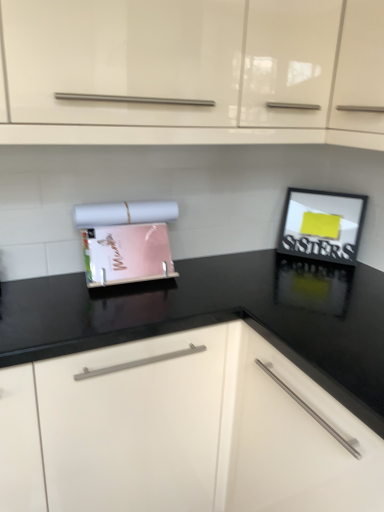
Question: From a real-world perspective, is black matte picture frame at upper right positioned above or below black glossy countertop at center, the first cabinetry in the bottom-to-top sequence?

Choices:
 (A) above
 (B) below

Answer: (A)

Question: In terms of height, does black matte picture frame at upper right look taller or shorter compared to black glossy countertop at center, placed as the 2th cabinetry when sorted from top to bottom?

Choices:
 (A) tall
 (B) short

Answer: (B)

Question: Which object is positioned farthest from the black glossy countertop at center, the first cabinetry in the bottom-to-top sequence?

Choices:
 (A) black matte picture frame at upper right
 (B) glossy white cabinet at upper center, the second cabinetry in the bottom-to-top sequence
 (C) matte plastic magazine holder at center

Answer: (A)

Question: Based on their relative distances, which object is farther from the matte plastic magazine holder at center?

Choices:
 (A) black matte picture frame at upper right
 (B) glossy white cabinet at upper center, which appears as the 1th cabinetry when viewed from the top
 (C) black glossy countertop at center, the first cabinetry in the bottom-to-top sequence

Answer: (A)